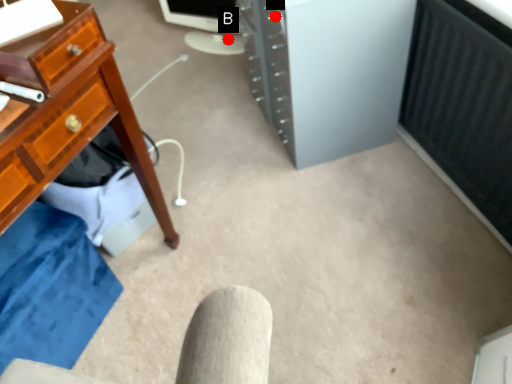
Question: Two points are circled on the image, labeled by A and B beside each circle. Which point is farther to the camera?

Choices:
 (A) A is further
 (B) B is further

Answer: (B)